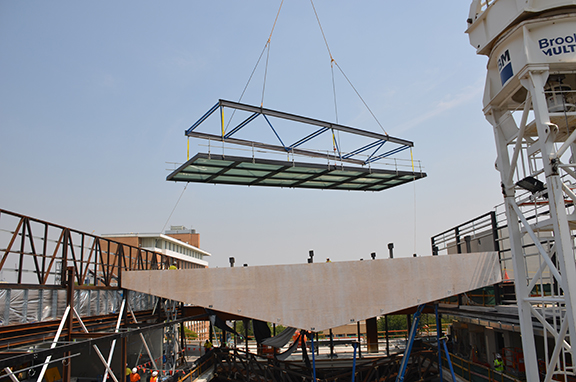
At what (x,y) coordinates should I click in order to perform the action: click on wooden beams. Please return your answer as a coordinate pair (x, y). Looking at the image, I should click on pyautogui.click(x=66, y=235).